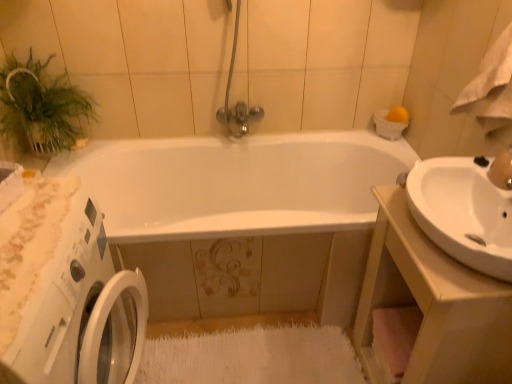
Question: Do you think green leafy plant at upper left is within white glossy sink at right, or outside of it?

Choices:
 (A) outside
 (B) inside

Answer: (A)

Question: In the image, is green leafy plant at upper left positioned in front of or behind white glossy sink at right?

Choices:
 (A) front
 (B) behind

Answer: (B)

Question: Estimate the real-world distances between objects in this image. Which object is closer to the white glossy washing machine at left?

Choices:
 (A) green leafy plant at upper left
 (B) white soft towel at upper right
 (C) matte gold faucet at upper right
 (D) white glossy sink at right
 (E) white glossy sink at right

Answer: (E)

Question: Which object is the farthest from the white soft towel at upper right?

Choices:
 (A) white glossy washing machine at left
 (B) matte gold faucet at upper right
 (C) white glossy sink at right
 (D) green leafy plant at upper left
 (E) white glossy sink at right

Answer: (D)